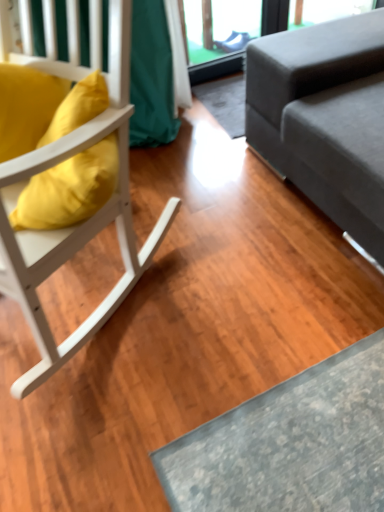
Where is `free area below white wood chair at left (from a real-world perspective)`? The height and width of the screenshot is (512, 384). free area below white wood chair at left (from a real-world perspective) is located at coordinates (91, 298).